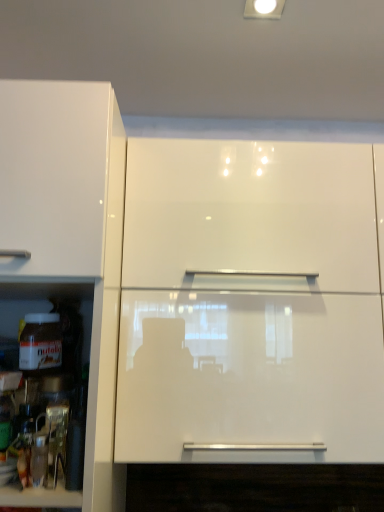
Question: Should I look upward or downward to see glossy white cabinet at upper center?

Choices:
 (A) up
 (B) down

Answer: (B)

Question: From a real-world perspective, is white glossy cabinet at left physically above glossy white cabinet at upper center?

Choices:
 (A) no
 (B) yes

Answer: (A)

Question: Is glossy white cabinet at upper center at the back of white glossy cabinet at left?

Choices:
 (A) no
 (B) yes

Answer: (A)

Question: Can you confirm if white glossy cabinet at left is wider than glossy white cabinet at upper center?

Choices:
 (A) no
 (B) yes

Answer: (B)

Question: From the image's perspective, does white glossy cabinet at left appear lower than glossy white cabinet at upper center?

Choices:
 (A) yes
 (B) no

Answer: (A)

Question: Is white glossy cabinet at left outside of glossy white cabinet at upper center?

Choices:
 (A) yes
 (B) no

Answer: (A)

Question: Is the position of white glossy cabinet at left more distant than that of glossy white cabinet at upper center?

Choices:
 (A) no
 (B) yes

Answer: (A)

Question: Considering the relative sizes of glossy white cabinet at upper center and white glossy cabinet at left in the image provided, is glossy white cabinet at upper center smaller than white glossy cabinet at left?

Choices:
 (A) no
 (B) yes

Answer: (B)

Question: Is glossy white cabinet at upper center positioned in front of white glossy cabinet at left?

Choices:
 (A) yes
 (B) no

Answer: (B)

Question: Is glossy white cabinet at upper center turned away from white glossy cabinet at left?

Choices:
 (A) no
 (B) yes

Answer: (A)

Question: Is glossy white cabinet at upper center bigger than white glossy cabinet at left?

Choices:
 (A) yes
 (B) no

Answer: (B)

Question: From the image's perspective, is glossy white cabinet at upper center located beneath white glossy cabinet at left?

Choices:
 (A) yes
 (B) no

Answer: (B)

Question: Is there a large distance between glossy white cabinet at upper center and white glossy cabinet at left?

Choices:
 (A) yes
 (B) no

Answer: (B)

Question: Is glossy white cabinet at upper center in front of or behind white glossy cabinet at left in the image?

Choices:
 (A) front
 (B) behind

Answer: (B)